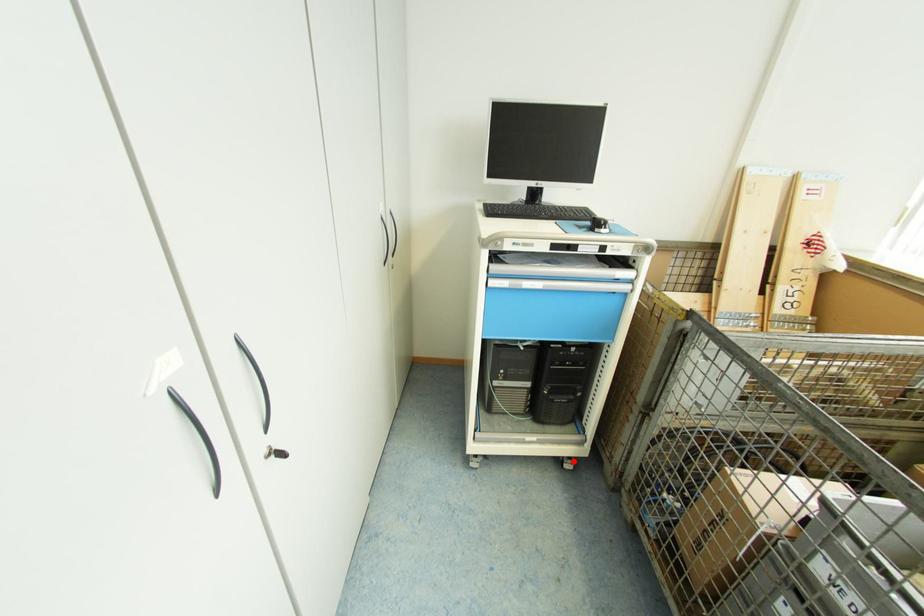
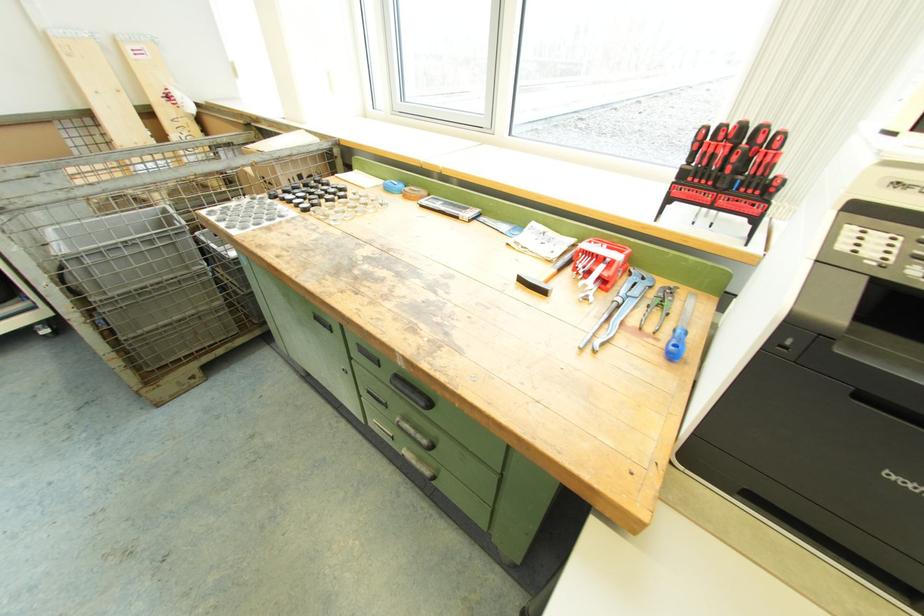
In the second image, find the point that corresponds to the highlighted location in the first image.

(43, 326)